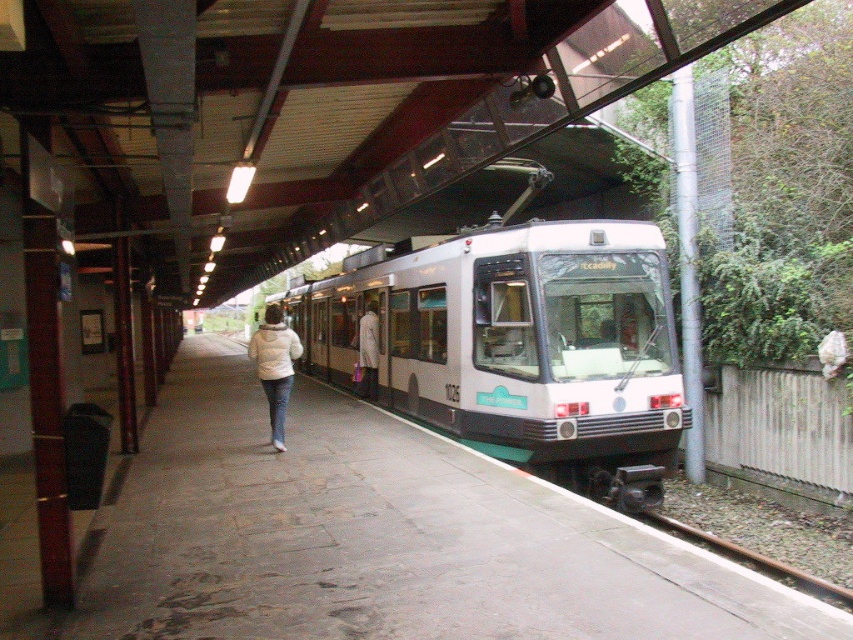
You are a GUI agent. You are given a task and a screenshot of the screen. Output one action in this format:
    pyautogui.click(x=<x>, y=<y>)
    Task: Click on the concrete platform at center
    Image resolution: width=853 pixels, height=640 pixels.
    Given the screenshot: What is the action you would take?
    pyautogui.click(x=384, y=536)

What do you see at coordinates (384, 536) in the screenshot? I see `concrete platform at center` at bounding box center [384, 536].

Find the location of a particular element. The width and height of the screenshot is (853, 640). concrete platform at center is located at coordinates (384, 536).

Who is shorter, white fleece jacket at center or brown metal train track at lower right?

With less height is brown metal train track at lower right.

Does white fleece jacket at center have a lesser height compared to brown metal train track at lower right?

No.

Measure the distance between white fleece jacket at center and camera.

white fleece jacket at center and camera are 9.26 meters apart.

I want to click on white fleece jacket at center, so click(274, 365).

Is point (125, 564) closer to viewer compared to point (387, 362)?

Yes, point (125, 564) is in front of point (387, 362).

Between concrete platform at center and white glossy train at center, which one appears on the left side from the viewer's perspective?

concrete platform at center is more to the left.

At what (x,y) coordinates should I click in order to perform the action: click on concrete platform at center. Please return your answer as a coordinate pair (x, y). Looking at the image, I should click on (384, 536).

In order to click on concrete platform at center in this screenshot , I will do `click(384, 536)`.